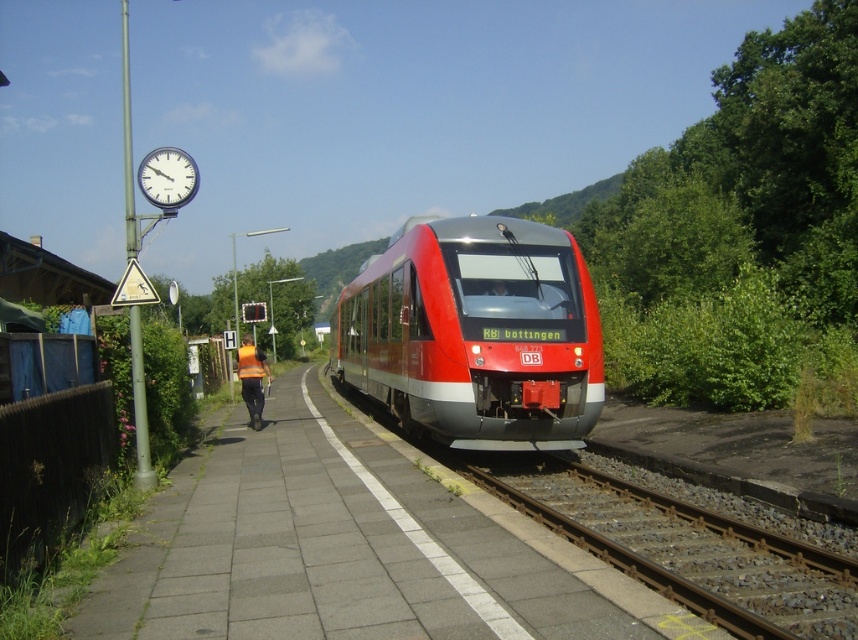
Who is taller, red metallic train at center or reflective orange vest at center?

red metallic train at center

Is red metallic train at center taller than reflective orange vest at center?

Yes, red metallic train at center is taller than reflective orange vest at center.

Between point (548, 360) and point (248, 376), which one is positioned behind?

Positioned behind is point (248, 376).

This screenshot has width=858, height=640. What are the coordinates of `red metallic train at center` in the screenshot? It's located at (x=475, y=333).

Which is behind, point (754, 557) or point (263, 372)?

Point (263, 372)

Is brown gravel train track at lower center smaller than reflective orange vest at center?

Yes, brown gravel train track at lower center is smaller than reflective orange vest at center.

Which is in front, point (739, 605) or point (242, 346)?

Positioned in front is point (739, 605).

Identify the location of brown gravel train track at lower center. (684, 547).

Between red metallic train at center and brown gravel train track at lower center, which one is positioned higher?

Positioned higher is red metallic train at center.

Is the position of red metallic train at center less distant than that of brown gravel train track at lower center?

That is False.

Which is in front, point (434, 241) or point (781, 608)?

Positioned in front is point (781, 608).

The height and width of the screenshot is (640, 858). I want to click on red metallic train at center, so click(x=475, y=333).